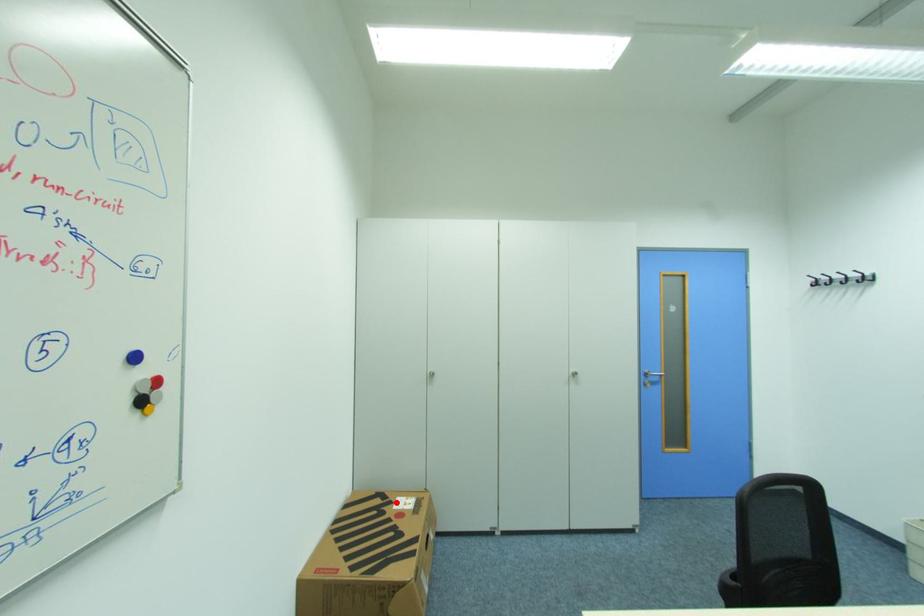
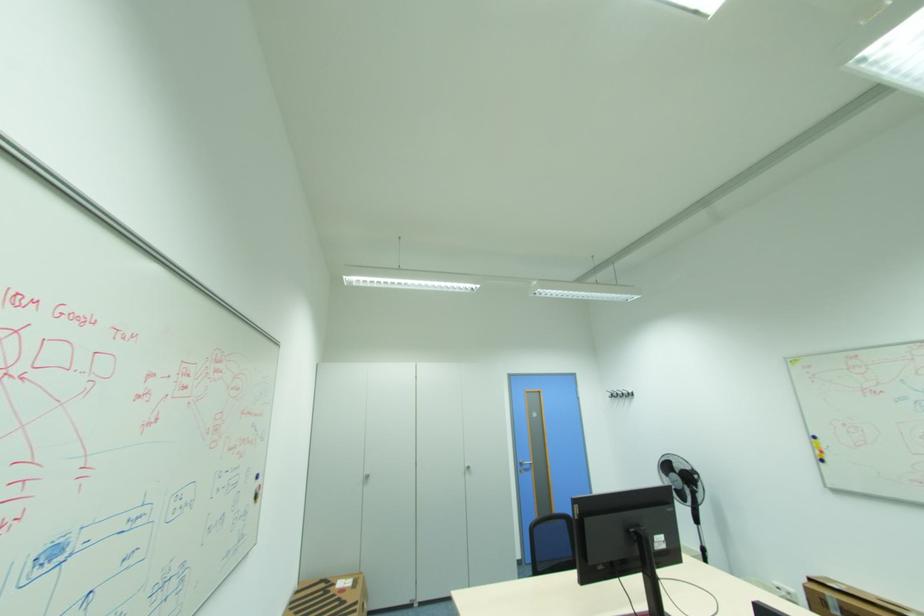
The point at the highlighted location is marked in the first image. Where is the corresponding point in the second image?

(338, 585)